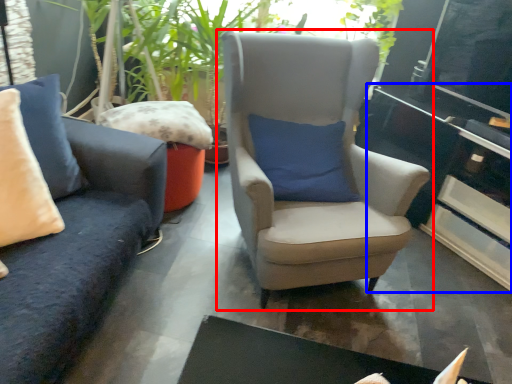
Question: Which object is further to the camera taking this photo, chair (highlighted by a red box) or table (highlighted by a blue box)?

Choices:
 (A) chair
 (B) table

Answer: (B)